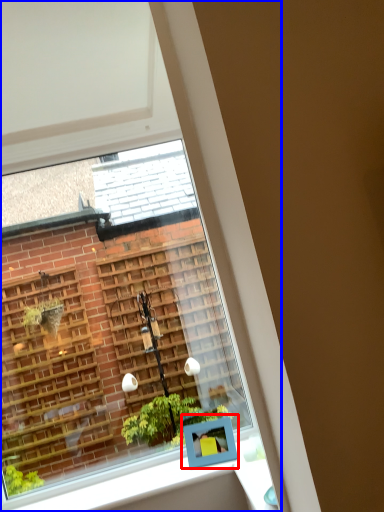
Question: Which point is closer to the camera, window box (highlighted by a red box) or window (highlighted by a blue box)?

Choices:
 (A) window box
 (B) window

Answer: (A)